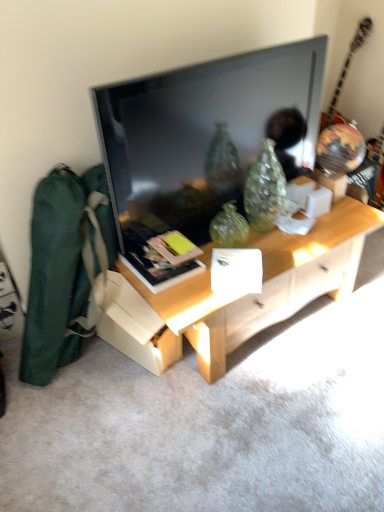
Locate an element on the screen. The width and height of the screenshot is (384, 512). vacant space situated above matte black book at center (from a real-world perspective) is located at coordinates (173, 263).